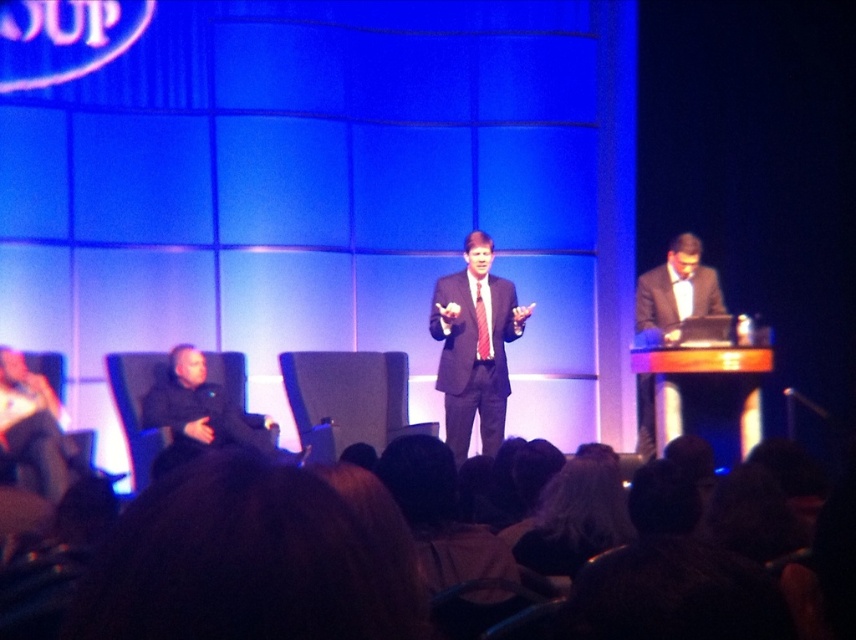
Which is in front, point (177, 444) or point (681, 314)?

Positioned in front is point (177, 444).

Between black leather jacket at left and matte black suit at center, which one has less height?

black leather jacket at left is shorter.

What do you see at coordinates (204, 410) in the screenshot? The width and height of the screenshot is (856, 640). I see `black leather jacket at left` at bounding box center [204, 410].

Image resolution: width=856 pixels, height=640 pixels. What are the coordinates of `black leather jacket at left` in the screenshot? It's located at (204, 410).

Does point (263, 486) lie in front of point (205, 424)?

Yes, it is.

Is brown hair at lower center above black leather jacket at left?

Yes, brown hair at lower center is above black leather jacket at left.

Is point (354, 595) farther from viewer compared to point (189, 385)?

No, (354, 595) is in front of (189, 385).

At what (x,y) coordinates should I click in order to perform the action: click on brown hair at lower center. Please return your answer as a coordinate pair (x, y). Looking at the image, I should click on (224, 566).

Which of these two, dark gray suit at center or black leather jacket at left, stands taller?

dark gray suit at center is taller.

Is dark gray suit at center shorter than black leather jacket at left?

No.

This screenshot has width=856, height=640. Find the location of `dark gray suit at center`. dark gray suit at center is located at coordinates (474, 346).

What are the coordinates of `dark gray suit at center` in the screenshot? It's located at (474, 346).